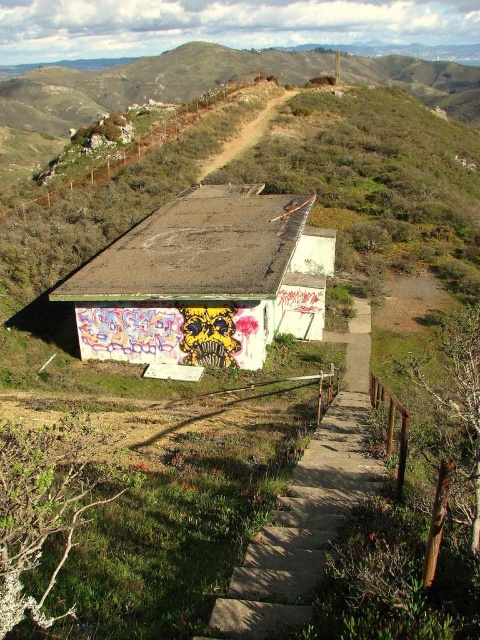
Question: Is rusty metal hut at center thinner than concrete/steps at center?

Choices:
 (A) yes
 (B) no

Answer: (B)

Question: Observing the image, what is the correct spatial positioning of rusty metal hut at center in reference to concrete/steps at center?

Choices:
 (A) below
 (B) above

Answer: (B)

Question: Is rusty metal hut at center bigger than concrete/steps at center?

Choices:
 (A) no
 (B) yes

Answer: (B)

Question: Which point is closer to the camera?

Choices:
 (A) rusty metal hut at center
 (B) concrete/steps at center

Answer: (B)

Question: Which point is farther from the camera taking this photo?

Choices:
 (A) (278, 212)
 (B) (298, 592)

Answer: (A)